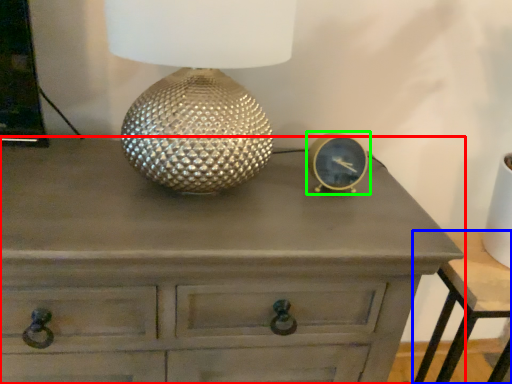
Question: Estimate the real-world distances between objects in this image. Which object is closer to chest of drawers (highlighted by a red box), nightstand (highlighted by a blue box) or pocket watch (highlighted by a green box)?

Choices:
 (A) nightstand
 (B) pocket watch

Answer: (B)